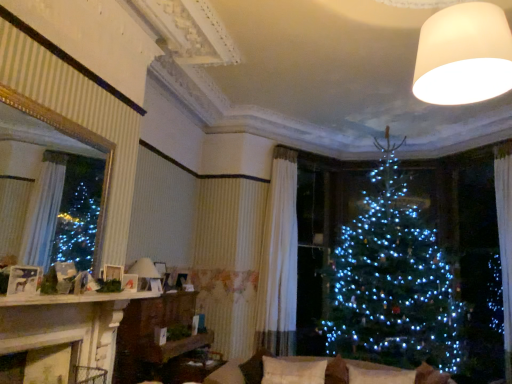
Question: From the image's perspective, is white soft cushion at center, marked as the 1th pillow in a left-to-right arrangement, located beneath beige fabric couch at lower center?

Choices:
 (A) no
 (B) yes

Answer: (B)

Question: Would you consider white soft cushion at center, marked as the 1th pillow in a left-to-right arrangement, to be distant from beige fabric couch at lower center?

Choices:
 (A) yes
 (B) no

Answer: (B)

Question: Can you confirm if white soft cushion at center, positioned as the 2th pillow in right-to-left order, is shorter than beige fabric couch at lower center?

Choices:
 (A) no
 (B) yes

Answer: (B)

Question: Is white soft cushion at center, marked as the 1th pillow in a left-to-right arrangement, bigger than beige fabric couch at lower center?

Choices:
 (A) no
 (B) yes

Answer: (A)

Question: Is white soft cushion at center, positioned as the 2th pillow in right-to-left order, in contact with beige fabric couch at lower center?

Choices:
 (A) no
 (B) yes

Answer: (A)

Question: Considering the positions of gold-framed mirror at left and beige fabric couch at lower center in the image, is gold-framed mirror at left taller or shorter than beige fabric couch at lower center?

Choices:
 (A) tall
 (B) short

Answer: (A)

Question: Is gold-framed mirror at left in front of or behind beige fabric couch at lower center in the image?

Choices:
 (A) behind
 (B) front

Answer: (B)

Question: From the image's perspective, is gold-framed mirror at left above or below beige fabric couch at lower center?

Choices:
 (A) below
 (B) above

Answer: (B)

Question: Choose the correct answer: Is gold-framed mirror at left inside beige fabric couch at lower center or outside it?

Choices:
 (A) inside
 (B) outside

Answer: (B)

Question: From the image's perspective, is gold-framed mirror at left located above or below white soft pillow at lower center, which appears as the first pillow when viewed from the right?

Choices:
 (A) below
 (B) above

Answer: (B)

Question: Is gold-framed mirror at left wider or thinner than white soft pillow at lower center, which appears as the first pillow when viewed from the right?

Choices:
 (A) wide
 (B) thin

Answer: (B)

Question: Relative to white soft pillow at lower center, acting as the 2th pillow starting from the left, is gold-framed mirror at left in front or behind?

Choices:
 (A) behind
 (B) front

Answer: (B)

Question: Is point (11, 99) positioned closer to the camera than point (410, 382)?

Choices:
 (A) farther
 (B) closer

Answer: (B)

Question: Would you say matte white picture frame at upper left, which ranks as the 2th picture frame in front-to-back order, is to the left or to the right of matte white picture frame at left, acting as the second picture frame starting from the back, in the picture?

Choices:
 (A) right
 (B) left

Answer: (A)

Question: Which is correct: matte white picture frame at upper left, the 1th picture frame viewed from the back, is inside matte white picture frame at left, which is the 1th picture frame from front to back, or outside of it?

Choices:
 (A) inside
 (B) outside

Answer: (B)